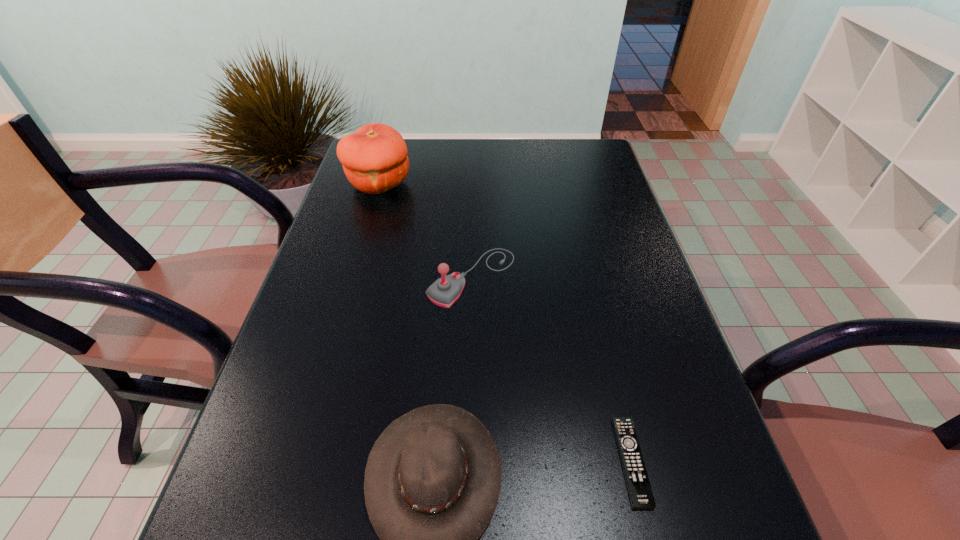
This screenshot has height=540, width=960. I want to click on object that is at the right edge, so click(x=640, y=493).

At what (x,y) coordinates should I click in order to perform the action: click on object situated at the far left corner. Please return your answer as a coordinate pair (x, y). The height and width of the screenshot is (540, 960). Looking at the image, I should click on (374, 158).

Where is `vacant region at the far edge of the desktop`? vacant region at the far edge of the desktop is located at coordinates tap(547, 176).

Locate an element on the screen. The image size is (960, 540). free space at the left edge of the desktop is located at coordinates (345, 215).

The width and height of the screenshot is (960, 540). I want to click on vacant space at the right edge, so click(x=629, y=405).

Locate an element on the screen. The width and height of the screenshot is (960, 540). vacant space at the far right corner is located at coordinates (601, 151).

Find the location of `free point between the joystick and the tallest object`. free point between the joystick and the tallest object is located at coordinates [x=425, y=230].

This screenshot has height=540, width=960. What are the coordinates of `empty space between the rightmost object and the joystick` in the screenshot? It's located at (551, 369).

Where is `empty space that is in between the leftmost object and the remote control`? Image resolution: width=960 pixels, height=540 pixels. empty space that is in between the leftmost object and the remote control is located at coordinates 505,322.

Find the location of a particular element. unoccupied position between the leftmost object and the third nearest object is located at coordinates (425, 230).